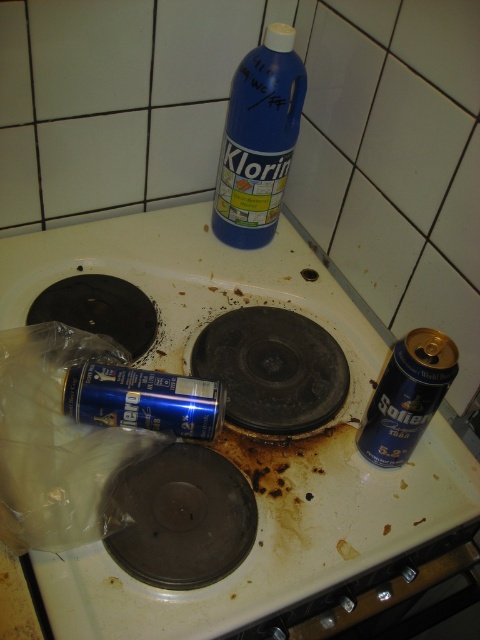
Consider the image. Can you confirm if blue metallic can at center is thinner than blue plastic bottle at upper center?

No, blue metallic can at center is not thinner than blue plastic bottle at upper center.

Between blue metallic can at center and blue plastic bottle at upper center, which one is positioned lower?

blue metallic can at center is lower down.

What do you see at coordinates (250, 436) in the screenshot? I see `blue metallic can at center` at bounding box center [250, 436].

You are a GUI agent. You are given a task and a screenshot of the screen. Output one action in this format:
    pyautogui.click(x=<x>, y=<y>)
    Task: Click on the blue metallic can at center
    
    Given the screenshot: What is the action you would take?
    pyautogui.click(x=250, y=436)